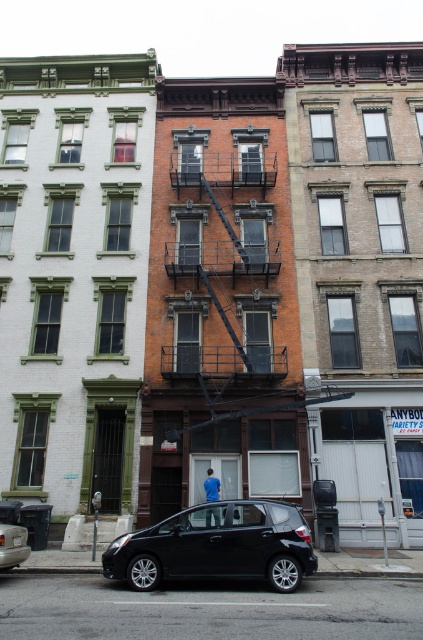
You are a delivery person trying to park your vehicle between the matte black car at lower center and the black matte car at lower left. Based on their positions, which side should you park on to be between them?

The matte black car at lower center is positioned on the right side of black matte car at lower left. To park between them, you should position your vehicle to the right of the black matte car at lower left and to the left of the matte black car at lower center.

You are a delivery driver who needs to park your vehicle between the matte black car at lower center and the black matte car at lower left. Given that your truck is 6 meters long, will there be enough space between them to park?

The matte black car at lower center is larger in size than the black matte car at lower left, but the exact distance between them isn generated in the Objects Description. Without knowing the actual spacing between the two cars, it is impossible to determine if there is sufficient space for a 6 meter long truck to park between them.